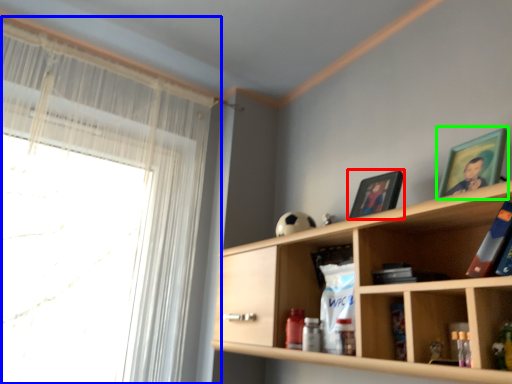
Question: Which is nearer to the picture frame (highlighted by a red box)? window (highlighted by a blue box) or picture frame (highlighted by a green box).

Choices:
 (A) window
 (B) picture frame

Answer: (B)